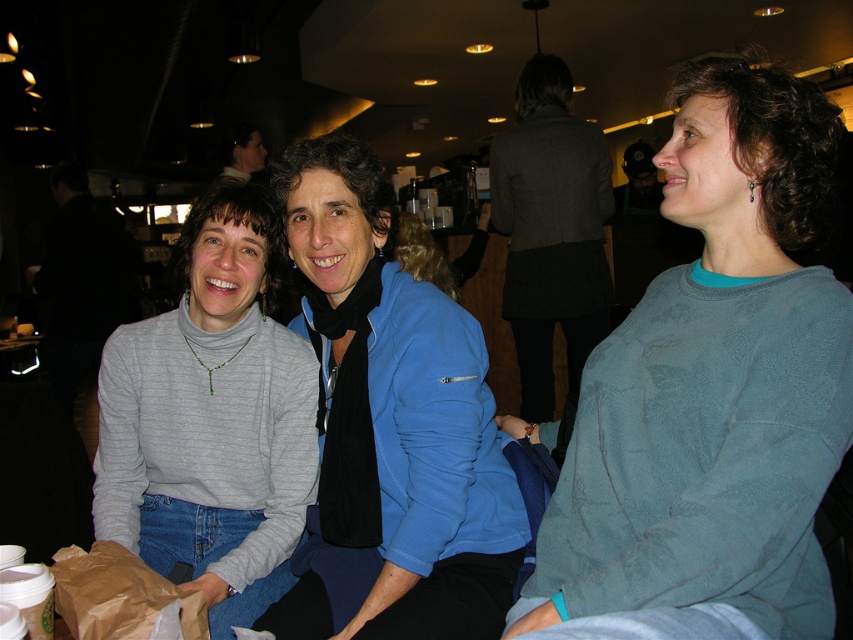
You are a photographer trying to capture a candid shot of the gray turtleneck sweater at center and the brown paper bag at lower left. Since you want both subjects to be in focus, you need to know which one is taller. Can you tell me which is taller?

The gray turtleneck sweater at center is much taller than the brown paper bag at lower left, so you should focus on the gray turtleneck sweater at center to ensure both are in focus.

You are a photographer trying to capture a clear shot of both the teal sweater at center and the gray turtleneck sweater at center. Since you can only focus on one at a time, which sweater should you choose to ensure the other is still somewhat in focus?

The teal sweater at center is closer to the viewer than the gray turtleneck sweater at center. To ensure both are somewhat in focus, you should focus on the teal sweater at center, as focusing on the closer object typically keeps the farther one more in focus compared to the reverse.

You are at a cafe and want to place your brown paper bag at lower left on the table. However, there is a gray turtleneck sweater at center in the way. Can you move the sweater to the right to make space for the bag?

The gray turtleneck sweater at center is already to the left of the brown paper bag at lower left, so moving it further to the right would not obstruct the placement of the bag. Therefore, you can move the sweater to the right to make space for the brown paper bag at lower left.